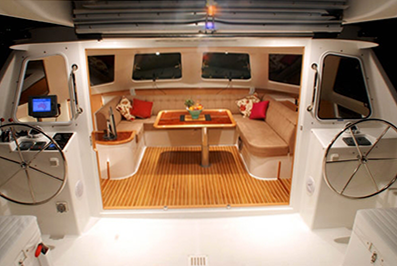
The width and height of the screenshot is (397, 266). I want to click on red throw pillows, so click(260, 110).